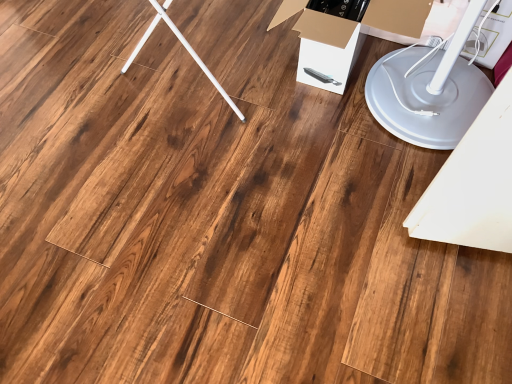
What is the approximate height of white plastic lift at lower right?

The height of white plastic lift at lower right is 22.07 inches.

The width and height of the screenshot is (512, 384). What do you see at coordinates (429, 90) in the screenshot?
I see `white plastic lift at lower right` at bounding box center [429, 90].

Find the location of a particular element. This screenshot has width=512, height=384. white plastic lift at lower right is located at coordinates (429, 90).

This screenshot has width=512, height=384. What do you see at coordinates (345, 32) in the screenshot? I see `white cardboard box at center` at bounding box center [345, 32].

Where is `white cardboard box at center`? The image size is (512, 384). white cardboard box at center is located at coordinates (345, 32).

Find the location of a particular element. The height and width of the screenshot is (384, 512). white plastic lift at lower right is located at coordinates (429, 90).

Which is more to the left, white plastic lift at lower right or white cardboard box at center?

From the viewer's perspective, white cardboard box at center appears more on the left side.

In the image, is white plastic lift at lower right positioned in front of or behind white cardboard box at center?

white plastic lift at lower right is in front of white cardboard box at center.

Is point (396, 64) farther from viewer compared to point (411, 0)?

Yes, it is.

From the image's perspective, between white plastic lift at lower right and white cardboard box at center, who is located below?

white plastic lift at lower right is shown below in the image.

From a real-world perspective, which is physically below, white plastic lift at lower right or white cardboard box at center?

In real-world perspective, white cardboard box at center is lower.

Which of these two, white plastic lift at lower right or white cardboard box at center, is thinner?

Thinner between the two is white cardboard box at center.

Between white plastic lift at lower right and white cardboard box at center, which one has less height?

With less height is white cardboard box at center.

Which of these two, white plastic lift at lower right or white cardboard box at center, is smaller?

white cardboard box at center is smaller.

Is white plastic lift at lower right situated inside white cardboard box at center or outside?

white plastic lift at lower right is not inside white cardboard box at center, it's outside.

Can you see white plastic lift at lower right touching white cardboard box at center?

No, white plastic lift at lower right is not touching white cardboard box at center.

Is white cardboard box at center at the back of white plastic lift at lower right?

No.

Can you tell me how much white plastic lift at lower right and white cardboard box at center differ in facing direction?

37 degrees separate the facing orientations of white plastic lift at lower right and white cardboard box at center.

Find the location of a particular element. This screenshot has height=384, width=512. lift below the white cardboard box at center (from the image's perspective) is located at coordinates click(429, 90).

Does white cardboard box at center appear on the left side of white plastic lift at lower right?

Yes.

Is white cardboard box at center positioned before white plastic lift at lower right?

No, it is not.

Is point (362, 14) closer to viewer compared to point (438, 78)?

Yes, point (362, 14) is in front of point (438, 78).

From the image's perspective, between white cardboard box at center and white plastic lift at lower right, who is located below?

→ white plastic lift at lower right.

From a real-world perspective, is white cardboard box at center above or below white plastic lift at lower right?

white cardboard box at center is situated lower than white plastic lift at lower right in the real world.

Considering the sizes of white cardboard box at center and white plastic lift at lower right in the image, is white cardboard box at center wider or thinner than white plastic lift at lower right?

white cardboard box at center is thinner than white plastic lift at lower right.

Between white cardboard box at center and white plastic lift at lower right, which one has more height?

Standing taller between the two is white plastic lift at lower right.

Looking at the image, does white cardboard box at center seem bigger or smaller compared to white plastic lift at lower right?

Considering their sizes, white cardboard box at center takes up less space than white plastic lift at lower right.

Is white cardboard box at center inside or outside of white plastic lift at lower right?

white cardboard box at center fits inside white plastic lift at lower right.

Is there a large distance between white cardboard box at center and white plastic lift at lower right?

white cardboard box at center is near white plastic lift at lower right, not far away.

Does white cardboard box at center turn towards white plastic lift at lower right?

Yes, white cardboard box at center is turned towards white plastic lift at lower right.

Locate an element on the screen. cardboard box that is above the white plastic lift at lower right (from the image's perspective) is located at coordinates (345, 32).

Identify the location of lift that is above the white cardboard box at center (from a real-world perspective). This screenshot has height=384, width=512. (429, 90).

What are the coordinates of `cardboard box lying above the white plastic lift at lower right (from the image's perspective)` in the screenshot? It's located at (345, 32).